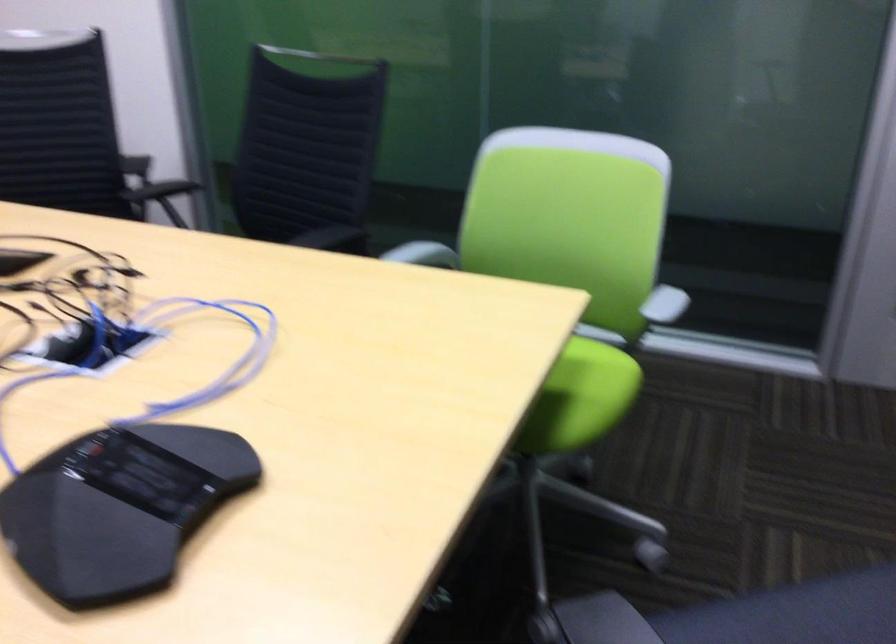
Find where to sit the green chair sitting surface. Please return your answer as a coordinate pair (x, y).

(590, 392)